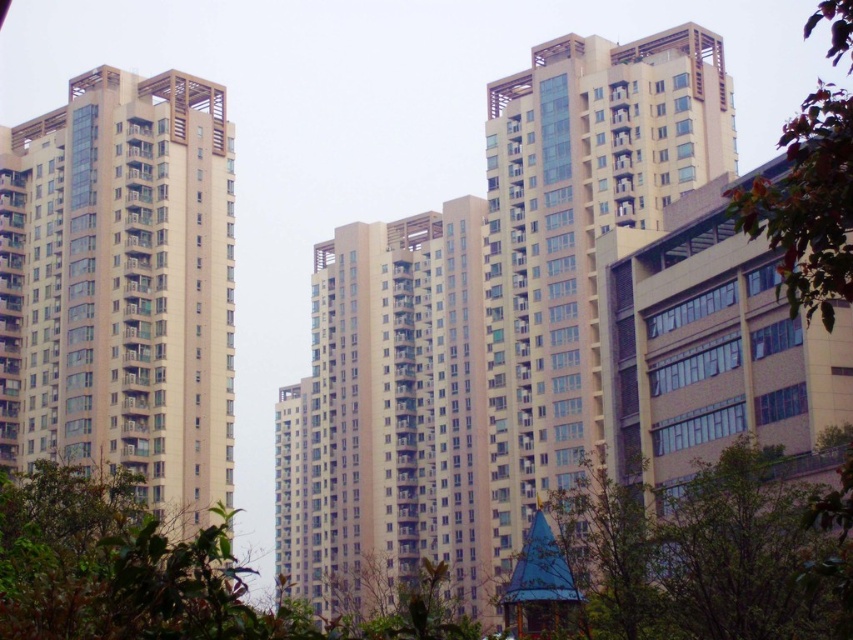
Question: Which is nearer to the beige glass building at center?

Choices:
 (A) beige smooth building at left
 (B) green leafy tree at lower center

Answer: (B)

Question: Based on their relative distances, which object is nearer to the beige glass building at center?

Choices:
 (A) green leafy tree at right
 (B) beige smooth building at left

Answer: (B)

Question: Is beige glass building at center thinner than green leafy tree at lower center?

Choices:
 (A) no
 (B) yes

Answer: (A)

Question: Can you confirm if beige glass building at center is thinner than green leafy tree at right?

Choices:
 (A) yes
 (B) no

Answer: (A)

Question: Which point is closer to the camera?

Choices:
 (A) beige smooth building at left
 (B) green leafy tree at right
 (C) green leafy tree at lower center
 (D) beige glass building at center

Answer: (B)

Question: Is beige smooth building at left thinner than beige glass building at center?

Choices:
 (A) yes
 (B) no

Answer: (B)